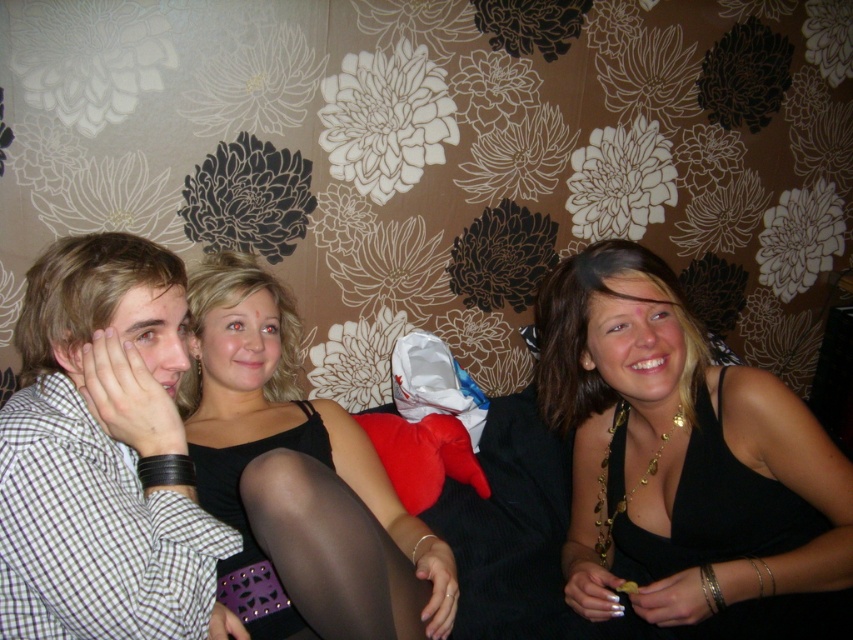
Question: Which object is positioned closest to the black satin tank top at center?

Choices:
 (A) black mesh tights at center
 (B) checkered fabric shirt at left
 (C) black matte tank top at center
 (D) black satin dress at center

Answer: (A)

Question: Which is nearer to the black satin tank top at center?

Choices:
 (A) black matte tank top at center
 (B) black satin dress at center
 (C) black mesh tights at center
 (D) checkered fabric shirt at left

Answer: (C)

Question: Can you confirm if black matte tank top at center is smaller than black mesh tights at center?

Choices:
 (A) no
 (B) yes

Answer: (A)

Question: Does checkered fabric shirt at left appear over black matte tank top at center?

Choices:
 (A) no
 (B) yes

Answer: (B)

Question: Which object is closer to the camera taking this photo?

Choices:
 (A) black satin dress at center
 (B) black satin tank top at center
 (C) black mesh tights at center

Answer: (C)

Question: Does black matte tank top at center appear under black mesh tights at center?

Choices:
 (A) yes
 (B) no

Answer: (B)